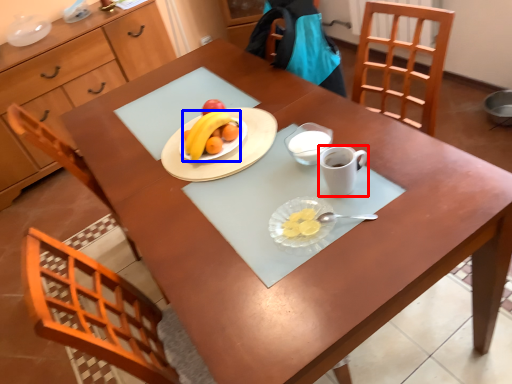
Question: Which object appears farthest to the camera in this image, coffee cup (highlighted by a red box) or grapefruit (highlighted by a blue box)?

Choices:
 (A) coffee cup
 (B) grapefruit

Answer: (B)